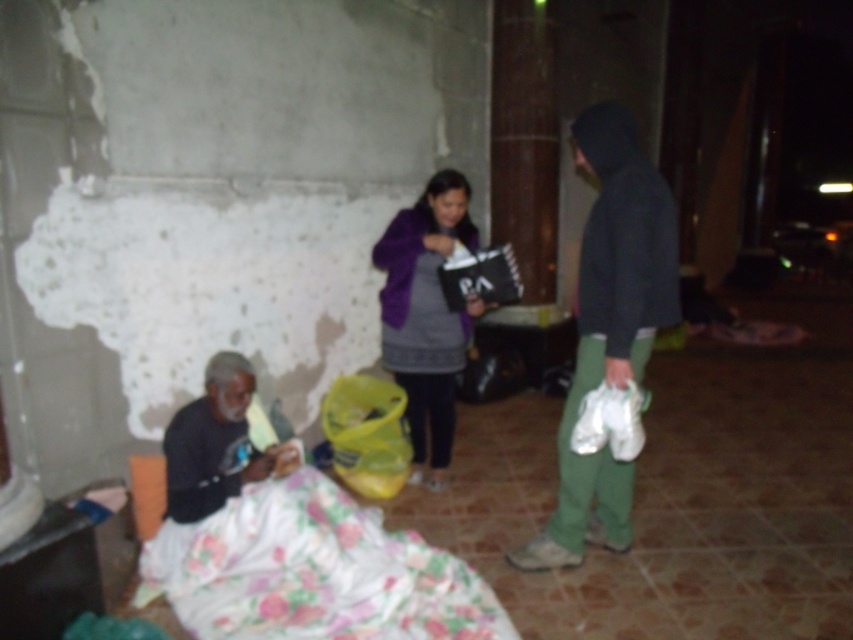
Question: Among these points, which one is farthest from the camera?

Choices:
 (A) (227, 419)
 (B) (450, 266)
 (C) (447, 314)

Answer: (C)

Question: Is purple fleece jacket at center smaller than black matte shirt at lower left?

Choices:
 (A) yes
 (B) no

Answer: (B)

Question: Can you confirm if white fabric bag at lower right is positioned to the right of black matte bag at center?

Choices:
 (A) yes
 (B) no

Answer: (A)

Question: Among these points, which one is farthest from the camera?

Choices:
 (A) (589, 493)
 (B) (221, 358)
 (C) (430, 200)
 (D) (637, 417)

Answer: (C)

Question: Is dark gray hoodie at right above black matte shirt at lower left?

Choices:
 (A) yes
 (B) no

Answer: (A)

Question: Among these objects, which one is nearest to the camera?

Choices:
 (A) purple fleece jacket at center
 (B) white fabric bag at lower right

Answer: (B)